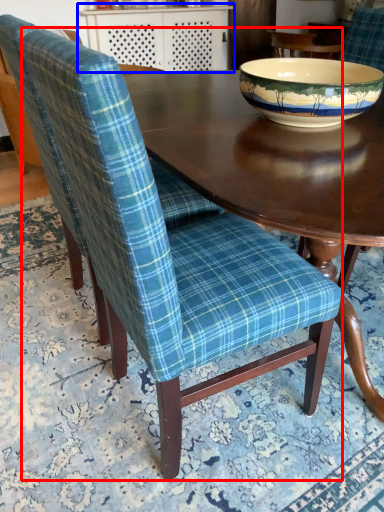
Question: Which object is further to the camera taking this photo, chair (highlighted by a red box) or table (highlighted by a blue box)?

Choices:
 (A) chair
 (B) table

Answer: (B)